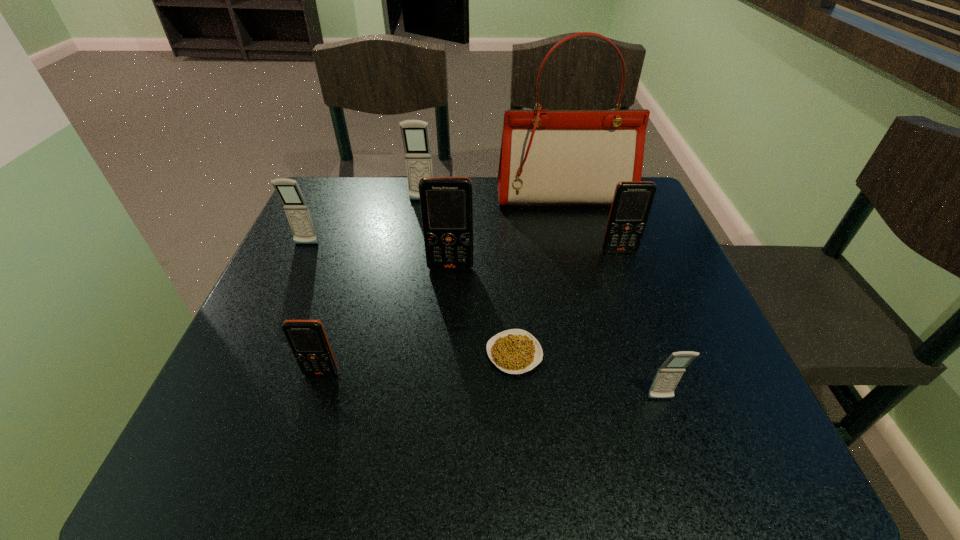
Identify the location of orange cellular telephone object that ranks as the third closest to the legume. Image resolution: width=960 pixels, height=540 pixels. (632, 201).

Image resolution: width=960 pixels, height=540 pixels. In order to click on orange cellular telephone that is the third nearest to the shortest object in this screenshot , I will do `click(632, 201)`.

Find the location of a particular element. vacant space that satisfies the following two spatial constraints: 1. on the screen of the legume; 2. on the right side of the third cellular telephone from right to left is located at coordinates (444, 354).

Where is `free space that satisfies the following two spatial constraints: 1. on the front-facing side of the leftmost object; 2. on the left side of the legume`? Image resolution: width=960 pixels, height=540 pixels. free space that satisfies the following two spatial constraints: 1. on the front-facing side of the leftmost object; 2. on the left side of the legume is located at coordinates (256, 354).